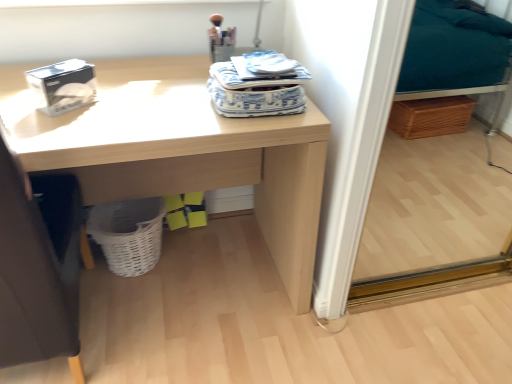
Question: Is white woven basket at lower left situated inside dark gray fabric swivel chair at left or outside?

Choices:
 (A) inside
 (B) outside

Answer: (B)

Question: Is white woven basket at lower left bigger or smaller than dark gray fabric swivel chair at left?

Choices:
 (A) big
 (B) small

Answer: (B)

Question: Which object is the farthest from the white woven basket at lower left?

Choices:
 (A) light wood desk at center
 (B) yellow matte box at lower center, which appears as the second box when viewed from the front
 (C) white matte tissue box at upper left, which ranks as the first box in left-to-right order
 (D) dark gray fabric swivel chair at left

Answer: (C)

Question: Considering the real-world distances, which object is farthest from the white matte tissue box at upper left, positioned as the second box in right-to-left order?

Choices:
 (A) light wood desk at center
 (B) yellow matte box at lower center, the second box when ordered from left to right
 (C) white woven basket at lower left
 (D) dark gray fabric swivel chair at left

Answer: (B)